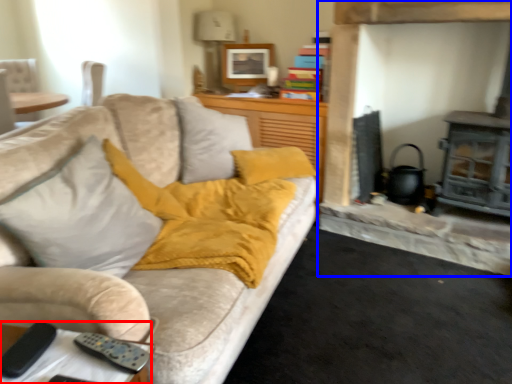
Question: Which object appears closest to the camera in this image, table (highlighted by a red box) or fireplace (highlighted by a blue box)?

Choices:
 (A) table
 (B) fireplace

Answer: (A)